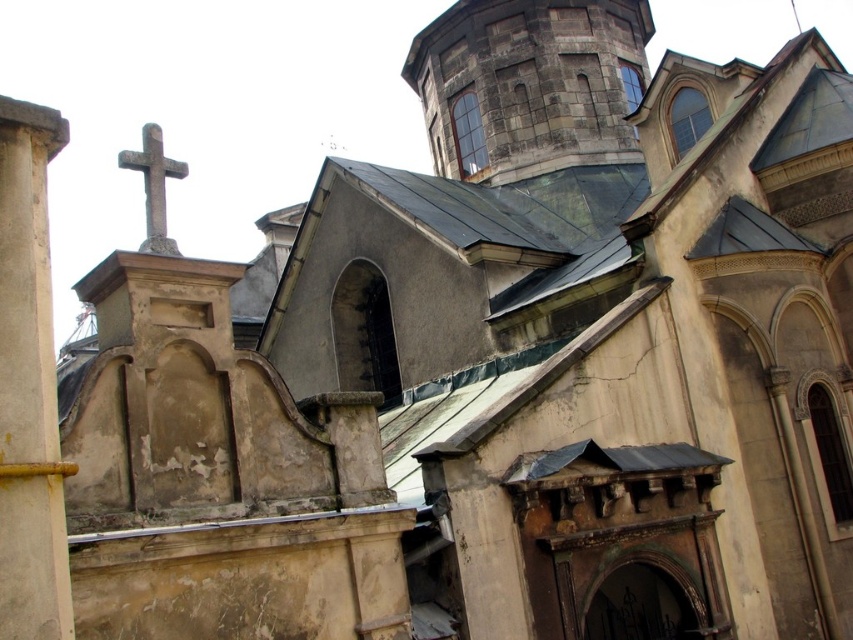
Is yellow painted concrete column at left bigger than smooth stone cross at upper left?

No, yellow painted concrete column at left is not bigger than smooth stone cross at upper left.

Is point (62, 125) positioned before point (186, 164)?

That is True.

The height and width of the screenshot is (640, 853). I want to click on yellow painted concrete column at left, so click(28, 387).